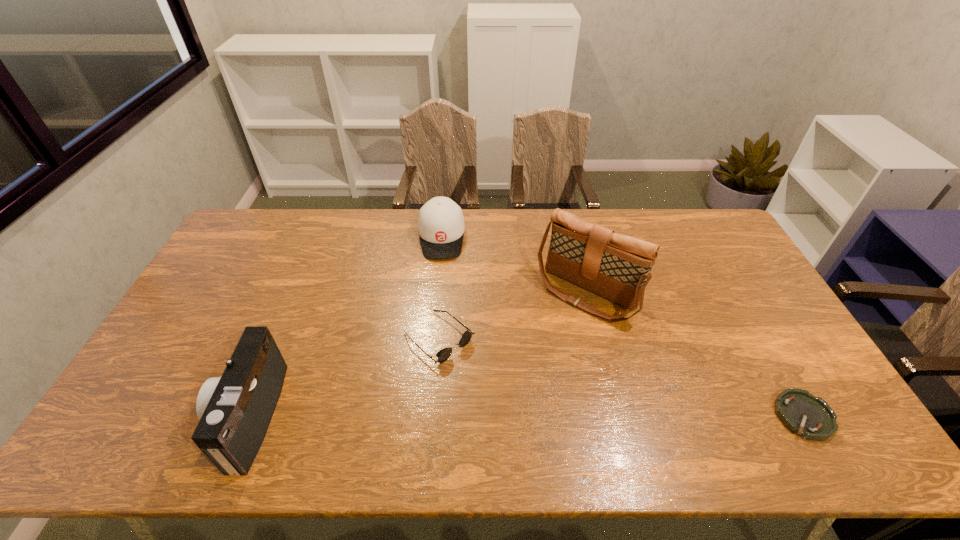
Identify the location of vacant space situated on the front-facing side of the third tallest object. (441, 338).

Where is `free space located on the front-facing side of the third tallest object`? free space located on the front-facing side of the third tallest object is located at coordinates (441, 325).

This screenshot has height=540, width=960. I want to click on object present at the far edge, so click(x=441, y=226).

This screenshot has height=540, width=960. I want to click on camcorder situated at the near edge, so click(235, 410).

Locate an element on the screen. The width and height of the screenshot is (960, 540). ashtray that is at the near edge is located at coordinates (810, 417).

Find the location of a particular element. This screenshot has width=960, height=540. object that is at the right edge is located at coordinates (810, 417).

Locate an element on the screen. The width and height of the screenshot is (960, 540). object present at the near right corner is located at coordinates [810, 417].

Where is `free space at the far edge of the desktop`? The image size is (960, 540). free space at the far edge of the desktop is located at coordinates (660, 239).

Where is `vacant space at the near edge of the desktop`? vacant space at the near edge of the desktop is located at coordinates (405, 399).

What are the coordinates of `free space at the left edge of the desktop` in the screenshot? It's located at (246, 278).